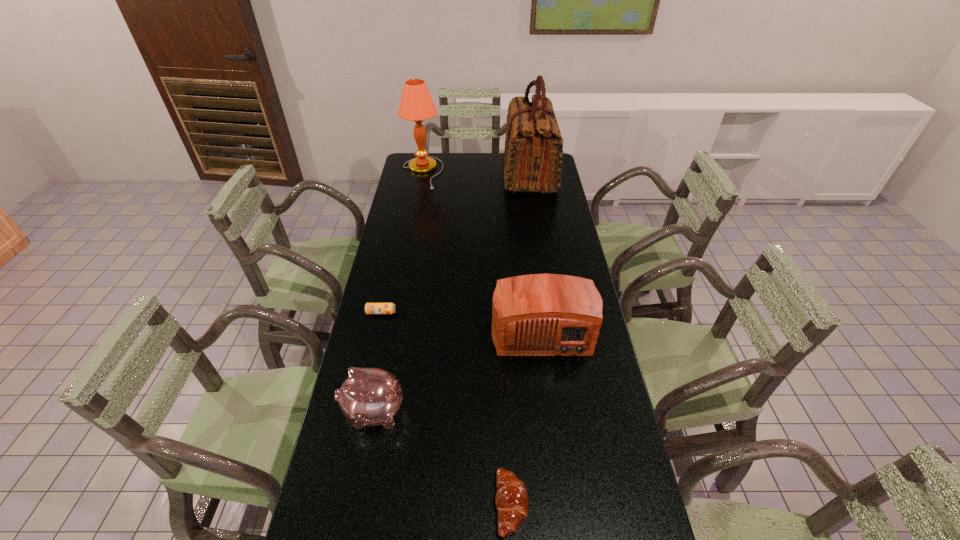
Where is `vacant point located on the front-facing side of the third tallest object`? vacant point located on the front-facing side of the third tallest object is located at coordinates (560, 466).

Image resolution: width=960 pixels, height=540 pixels. Identify the location of free space located 0.210m on the right of the shortest object. 460,313.

Locate an element on the screen. Image resolution: width=960 pixels, height=540 pixels. shopping bag present at the far edge is located at coordinates (533, 149).

At what (x,y) coordinates should I click in order to perform the action: click on lamp that is at the far edge. Please return your answer as a coordinate pair (x, y). Looking at the image, I should click on (416, 104).

In order to click on lamp that is at the left edge in this screenshot , I will do `click(416, 104)`.

Where is `piggy bank at the left edge`? piggy bank at the left edge is located at coordinates (370, 396).

The image size is (960, 540). I want to click on beer can positioned at the left edge, so click(370, 308).

This screenshot has height=540, width=960. I want to click on shopping bag that is at the right edge, so click(533, 149).

Find the location of a particular element. The height and width of the screenshot is (540, 960). radio receiver present at the right edge is located at coordinates (537, 314).

You are a GUI agent. You are given a task and a screenshot of the screen. Output one action in this format:
    pyautogui.click(x=<x>, y=<y>)
    Task: Click on the object that is at the far left corner
    
    Given the screenshot: What is the action you would take?
    pyautogui.click(x=416, y=104)